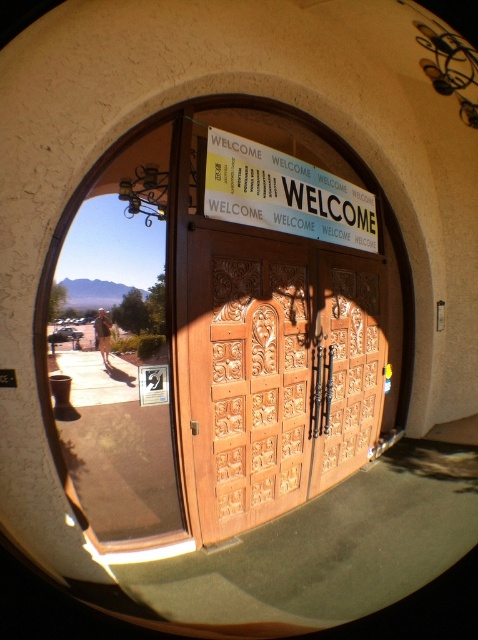
Question: Which object is farther from the camera taking this photo?

Choices:
 (A) wooden carved doors at center
 (B) yellow paper sign at center

Answer: (B)

Question: Is wooden carved doors at center to the right of yellow paper sign at center from the viewer's perspective?

Choices:
 (A) yes
 (B) no

Answer: (B)

Question: Considering the relative positions of wooden carved doors at center and yellow paper sign at center in the image provided, where is wooden carved doors at center located with respect to yellow paper sign at center?

Choices:
 (A) left
 (B) right

Answer: (A)

Question: Which object is farther from the camera taking this photo?

Choices:
 (A) yellow paper sign at center
 (B) wooden carved doors at center

Answer: (A)

Question: Can you confirm if wooden carved doors at center is positioned above yellow paper sign at center?

Choices:
 (A) yes
 (B) no

Answer: (B)

Question: Which point is farther to the camera?

Choices:
 (A) yellow paper sign at center
 (B) wooden carved doors at center

Answer: (A)